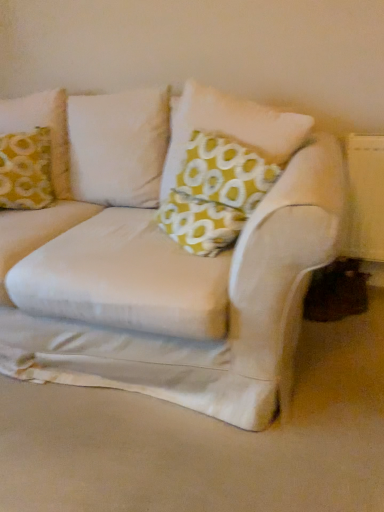
Question: Is yellow fabric pillow at upper left, marked as the 1th pillow in a left-to-right arrangement, smaller than yellow fabric pillow at center, which is counted as the 1th pillow, starting from the right?

Choices:
 (A) yes
 (B) no

Answer: (A)

Question: Does yellow fabric pillow at upper left, marked as the 1th pillow in a left-to-right arrangement, turn towards yellow fabric pillow at center, the 2th pillow when ordered from left to right?

Choices:
 (A) no
 (B) yes

Answer: (A)

Question: Is yellow fabric pillow at upper left, the second pillow positioned from the right, positioned beyond the bounds of yellow fabric pillow at center, the 2th pillow when ordered from left to right?

Choices:
 (A) no
 (B) yes

Answer: (B)

Question: Would you say yellow fabric pillow at center, which is counted as the 1th pillow, starting from the right, is part of yellow fabric pillow at upper left, the second pillow positioned from the right,'s contents?

Choices:
 (A) no
 (B) yes

Answer: (A)

Question: Is yellow fabric pillow at upper left, the second pillow positioned from the right, behind yellow fabric pillow at center, which is counted as the 1th pillow, starting from the right?

Choices:
 (A) yes
 (B) no

Answer: (A)

Question: Can you confirm if yellow fabric pillow at upper left, marked as the 1th pillow in a left-to-right arrangement, is positioned to the right of yellow fabric pillow at center, which is counted as the 1th pillow, starting from the right?

Choices:
 (A) no
 (B) yes

Answer: (A)

Question: Is yellow fabric pillow at upper left, the second pillow positioned from the right, inside yellow fabric pillow at center, the 2th pillow when ordered from left to right?

Choices:
 (A) yes
 (B) no

Answer: (B)

Question: From a real-world perspective, does yellow fabric pillow at center, the 2th pillow when ordered from left to right, stand above yellow fabric pillow at upper left, marked as the 1th pillow in a left-to-right arrangement?

Choices:
 (A) yes
 (B) no

Answer: (A)

Question: From a real-world perspective, is yellow fabric pillow at center, which is counted as the 1th pillow, starting from the right, positioned under yellow fabric pillow at upper left, marked as the 1th pillow in a left-to-right arrangement, based on gravity?

Choices:
 (A) yes
 (B) no

Answer: (B)

Question: Can you confirm if yellow fabric pillow at center, the 2th pillow when ordered from left to right, is smaller than yellow fabric pillow at upper left, the second pillow positioned from the right?

Choices:
 (A) yes
 (B) no

Answer: (B)

Question: Is yellow fabric pillow at center, the 2th pillow when ordered from left to right, outside of yellow fabric pillow at upper left, the second pillow positioned from the right?

Choices:
 (A) no
 (B) yes

Answer: (B)

Question: Does yellow fabric pillow at center, which is counted as the 1th pillow, starting from the right, have a lesser width compared to yellow fabric pillow at upper left, the second pillow positioned from the right?

Choices:
 (A) yes
 (B) no

Answer: (A)

Question: Is yellow fabric pillow at upper left, marked as the 1th pillow in a left-to-right arrangement, situated inside yellow fabric pillow at center, which is counted as the 1th pillow, starting from the right, or outside?

Choices:
 (A) inside
 (B) outside

Answer: (B)